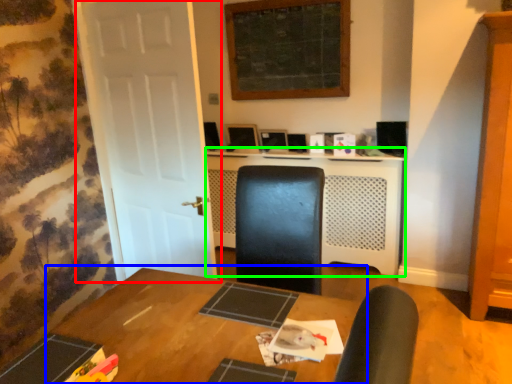
Question: Based on their relative distances, which object is nearer to door (highlighted by a red box)? Choose from table (highlighted by a blue box) and computer desk (highlighted by a green box).

Choices:
 (A) table
 (B) computer desk

Answer: (A)